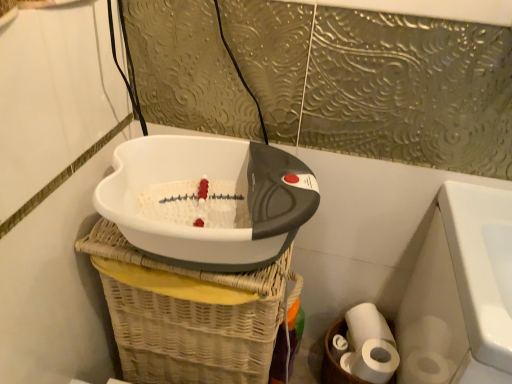
Question: From a real-world perspective, is white matte toilet paper at lower right positioned above or below white plastic footbath at center?

Choices:
 (A) above
 (B) below

Answer: (B)

Question: Looking at the image, does white matte toilet paper at lower right seem bigger or smaller compared to white plastic footbath at center?

Choices:
 (A) big
 (B) small

Answer: (B)

Question: Is white matte toilet paper at lower right spatially inside white plastic footbath at center, or outside of it?

Choices:
 (A) outside
 (B) inside

Answer: (A)

Question: Relative to white matte toilet paper at lower right, is white plastic footbath at center in front or behind?

Choices:
 (A) behind
 (B) front

Answer: (B)

Question: Is white plastic footbath at center inside or outside of white matte toilet paper at lower right?

Choices:
 (A) outside
 (B) inside

Answer: (A)

Question: From a real-world perspective, is white plastic footbath at center physically located above or below white matte toilet paper at lower right?

Choices:
 (A) below
 (B) above

Answer: (B)

Question: From the image's perspective, is white plastic footbath at center above or below white matte toilet paper at lower right?

Choices:
 (A) below
 (B) above

Answer: (B)